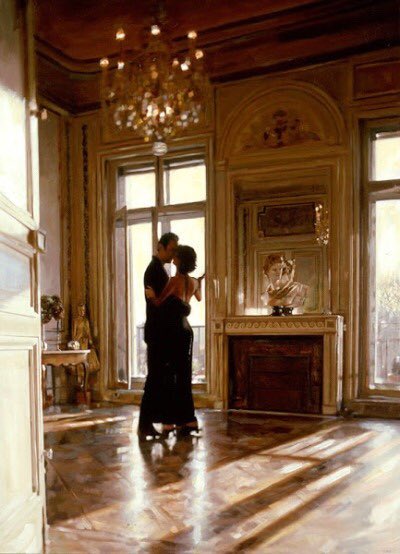
The width and height of the screenshot is (400, 554). I want to click on mantle, so click(245, 315).